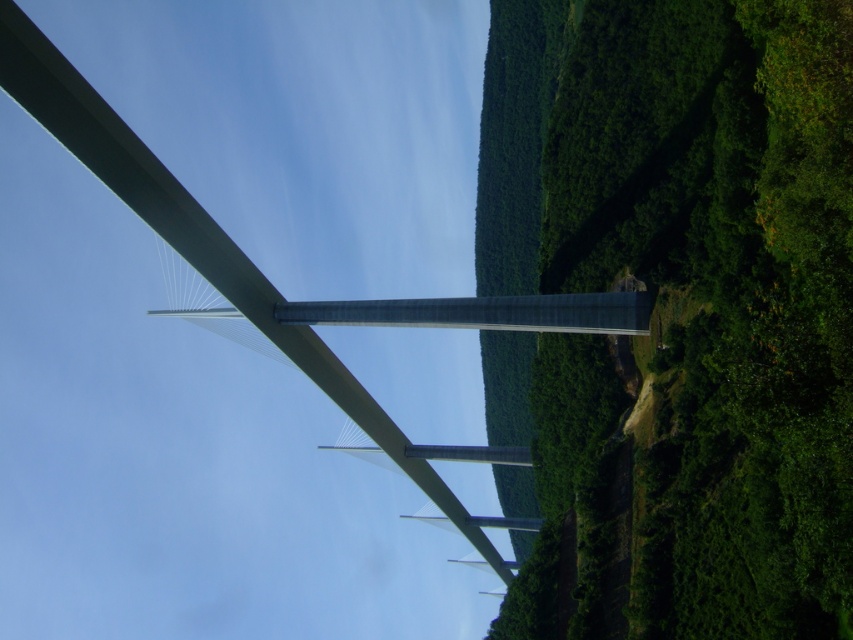
You are standing at the base of the Millau Viaduct and see two points marked on the bridge structure. The first point is at coordinates point (556, 481) and the second point is at point (209, 236). Which of these points is closer to your current position?

Point (209, 236) is closer to your current position because it is less further to the camera than point (556, 481).

You are standing in front of the Millau Viaduct and notice a green leafy tree at right and a metallic gray bridge at center. Which object is nearer to you?

The green leafy tree at right is closer to the viewer than the metallic gray bridge at center.

You are a drone operator tasked with capturing aerial footage of the Millau Viaduct. Your drone has a maximum flight range of 50 meters. If you are currently positioned at the green leafy tree at right, can you fly your drone to the metallic gray bridge at center without exceeding its flight range?

The distance between the green leafy tree at right and the metallic gray bridge at center is 48.67 meters. Since the drone has a maximum flight range of 50 meters, it can safely reach the bridge without exceeding its limit.